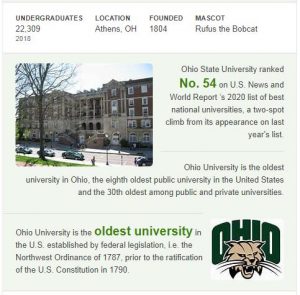
Locate an element on the screen. The height and width of the screenshot is (295, 300). stairs is located at coordinates (89, 141), (64, 139).